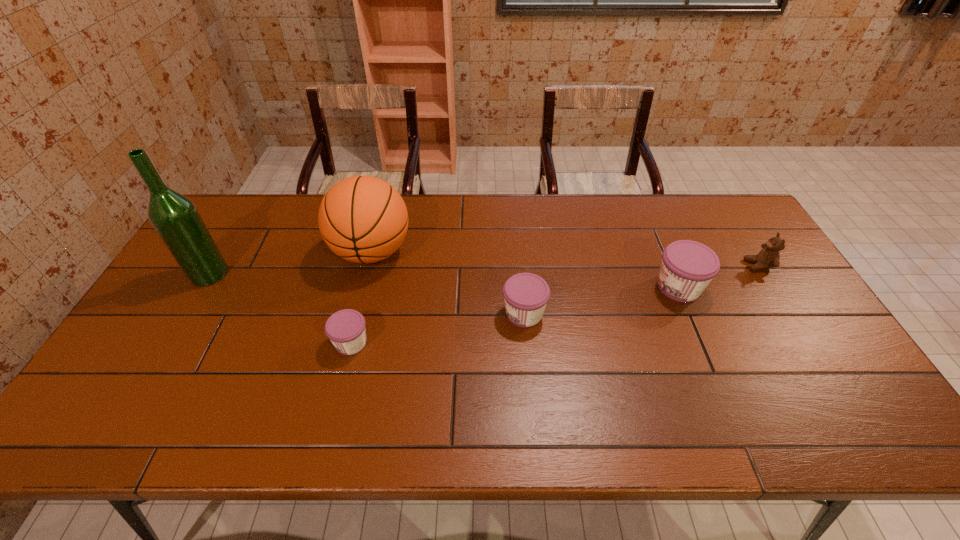
You are a GUI agent. You are given a task and a screenshot of the screen. Output one action in this format:
    pyautogui.click(x=<x>, y=<y>)
    Task: Click on the shortest object
    
    Given the screenshot: What is the action you would take?
    pyautogui.click(x=346, y=330)

This screenshot has width=960, height=540. Identify the location of the leftmost jam. (346, 330).

Find the location of a particular element. This screenshot has height=540, width=960. the fourth object from left to right is located at coordinates (525, 294).

Identify the location of the second tallest jam. (525, 294).

Locate an element on the screen. the fifth object from left to right is located at coordinates (687, 267).

I want to click on the rightmost jam, so click(687, 267).

At what (x,y) coordinates should I click in order to perform the action: click on the leftmost object. Please return your answer as a coordinate pair (x, y). Looking at the image, I should click on (175, 218).

Locate an element on the screen. the tallest object is located at coordinates (175, 218).

At what (x,y) coordinates should I click in order to perform the action: click on the second tallest object. Please return your answer as a coordinate pair (x, y). This screenshot has height=540, width=960. Looking at the image, I should click on (363, 219).

Find the location of a particular element. The image size is (960, 540). teddy bear is located at coordinates (768, 257).